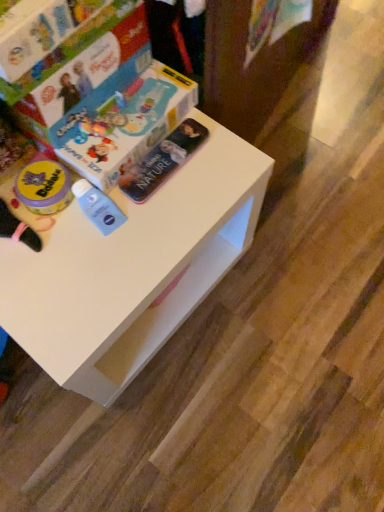
The height and width of the screenshot is (512, 384). Find the location of `free location in front of metallic silver book at center, positioned as the 2th paperback book in top-to-bottom order`. free location in front of metallic silver book at center, positioned as the 2th paperback book in top-to-bottom order is located at coordinates (152, 234).